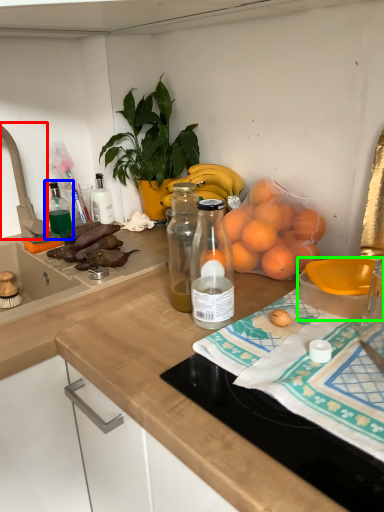
Question: Which object is positioned closest to faucet (highlighted by a red box)? Select from bottle (highlighted by a blue box) and bowl (highlighted by a green box).

Choices:
 (A) bottle
 (B) bowl

Answer: (A)